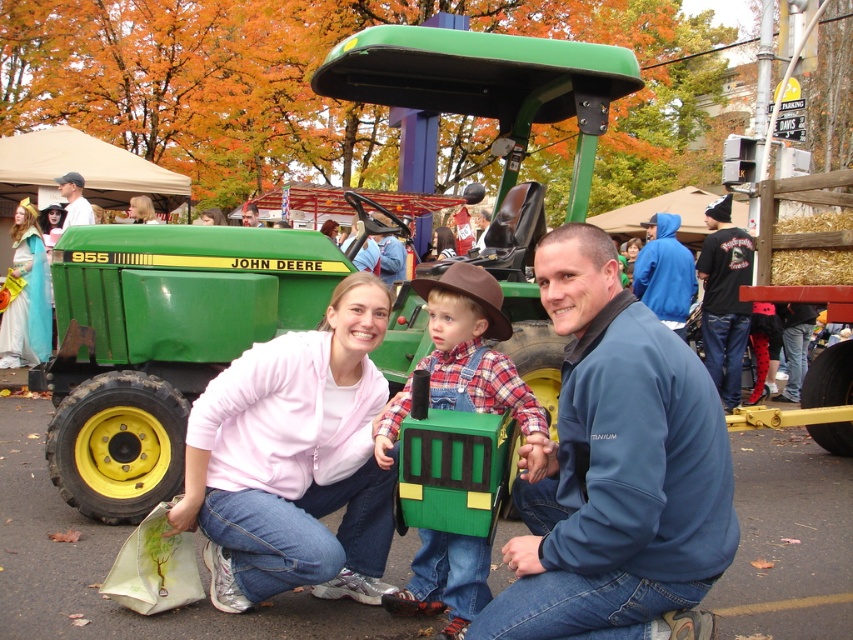
Question: Which point is farther from the camera taking this photo?

Choices:
 (A) (535, 464)
 (B) (360, 248)
 (C) (694, 276)

Answer: (C)

Question: Is pink fleece jacket at center below plaid fabric shirt at center?

Choices:
 (A) yes
 (B) no

Answer: (A)

Question: Which object is positioned farthest from the brushed metal water at bottle left?

Choices:
 (A) brushed metal hat at upper left
 (B) black cotton shirt at right
 (C) blue fleece jacket at center

Answer: (C)

Question: Is the position of blue fleece jacket at upper right more distant than that of brushed metal water at bottle left?

Choices:
 (A) yes
 (B) no

Answer: (B)

Question: Can you confirm if plaid fabric shirt at center is positioned to the right of brushed metal water at bottle left?

Choices:
 (A) yes
 (B) no

Answer: (A)

Question: Which of these objects is positioned closest to the black cotton shirt at right?

Choices:
 (A) brushed metal hat at upper left
 (B) pink fleece jacket at center
 (C) brown matte cowboy hat at center
 (D) matte brown cowboy hat at center

Answer: (D)